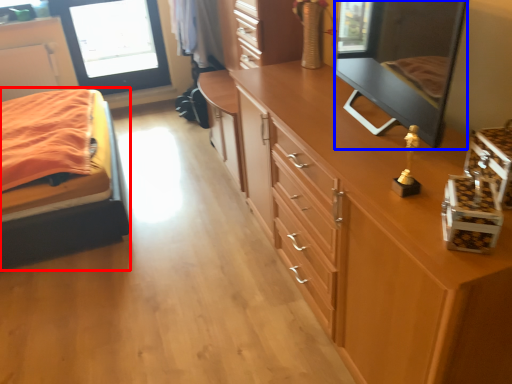
Question: Which point is further to the camera, bed (highlighted by a red box) or mirror (highlighted by a blue box)?

Choices:
 (A) bed
 (B) mirror

Answer: (A)